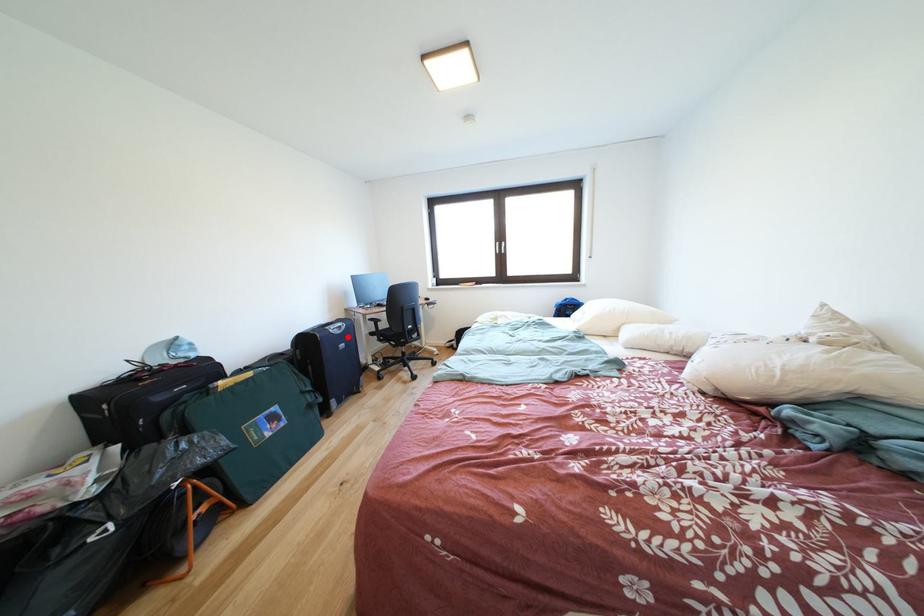
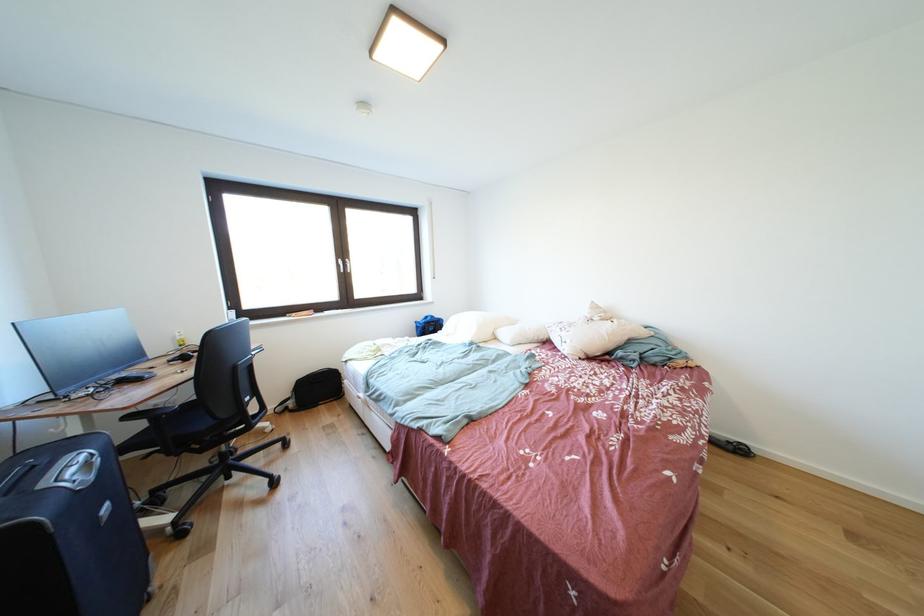
Question: A red point is marked in image1. In image2, is the corresponding 3D point closer to the camera or farther? Reply with the corresponding letter.

Choices:
 (A) The corresponding 3D point is closer.
 (B) The corresponding 3D point is farther.

Answer: (B)